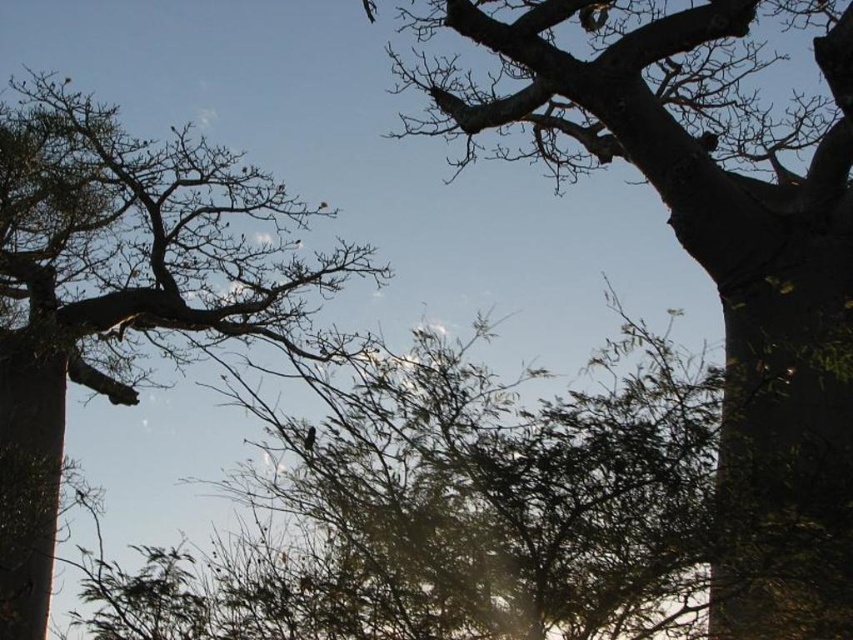
Question: Is rough bark tree at upper right closer to the viewer compared to smooth bark tree at left?

Choices:
 (A) no
 (B) yes

Answer: (B)

Question: Which point appears farthest from the camera in this image?

Choices:
 (A) (88, 188)
 (B) (509, 93)

Answer: (A)

Question: Among these points, which one is nearest to the camera?

Choices:
 (A) (444, 100)
 (B) (42, 596)

Answer: (B)

Question: Does rough bark tree at upper right come behind smooth bark tree at left?

Choices:
 (A) no
 (B) yes

Answer: (A)

Question: Which point is closer to the camera?

Choices:
 (A) (648, 80)
 (B) (260, 192)

Answer: (A)

Question: Is rough bark tree at upper right to the left of smooth bark tree at left from the viewer's perspective?

Choices:
 (A) yes
 (B) no

Answer: (B)